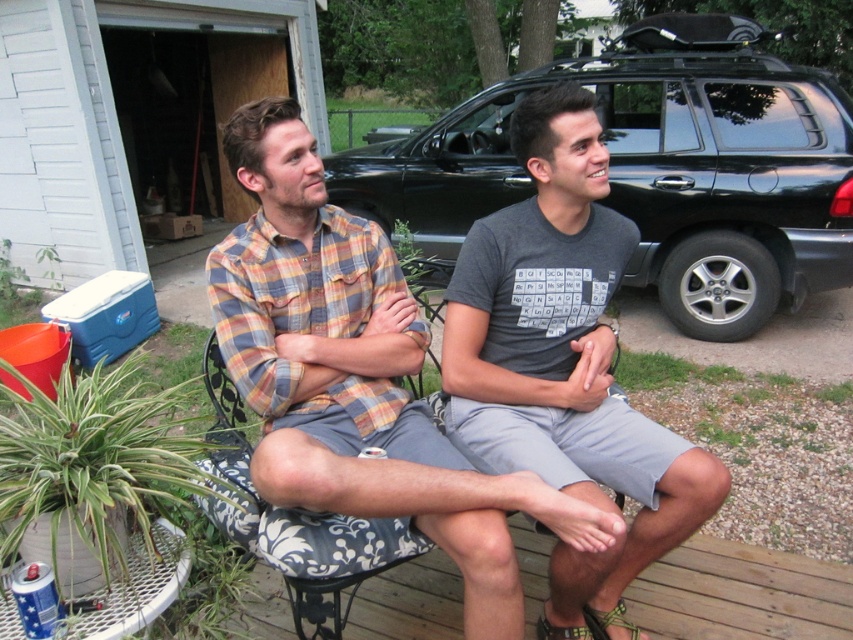
Question: Which is nearer to the plaid cotton shirt at center?

Choices:
 (A) gray fabric shirt at center
 (B) black matte suv at upper right

Answer: (A)

Question: Which object is positioned closest to the gray fabric shirt at center?

Choices:
 (A) plaid cotton shirt at center
 (B) black matte suv at upper right

Answer: (A)

Question: Which point is farther from the camera taking this photo?

Choices:
 (A) (399, 333)
 (B) (624, 205)

Answer: (B)

Question: Is black matte suv at upper right wider than plaid cotton shirt at center?

Choices:
 (A) yes
 (B) no

Answer: (A)

Question: Is plaid cotton shirt at center to the right of gray fabric shirt at center from the viewer's perspective?

Choices:
 (A) yes
 (B) no

Answer: (B)

Question: Is black matte suv at upper right closer to the viewer compared to plaid cotton shirt at center?

Choices:
 (A) no
 (B) yes

Answer: (A)